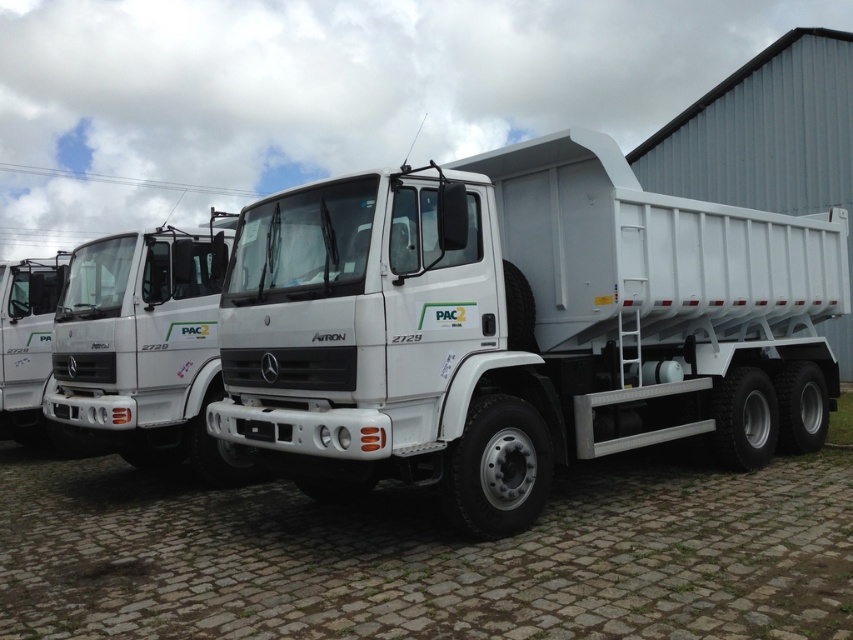
Question: Is white matte trailer truck at center positioned before white matte truck at center?

Choices:
 (A) no
 (B) yes

Answer: (B)

Question: Which object appears closest to the camera in this image?

Choices:
 (A) white matte truck at center
 (B) white matte trailer truck at center

Answer: (B)

Question: Which of the following is the farthest from the observer?

Choices:
 (A) (152, 461)
 (B) (390, 390)

Answer: (A)

Question: Is white matte trailer truck at center bigger than white matte truck at center?

Choices:
 (A) no
 (B) yes

Answer: (A)

Question: Can you confirm if white matte trailer truck at center is positioned to the right of white matte truck at center?

Choices:
 (A) no
 (B) yes

Answer: (B)

Question: Which point is farther to the camera?

Choices:
 (A) white matte trailer truck at center
 (B) white matte truck at center

Answer: (B)